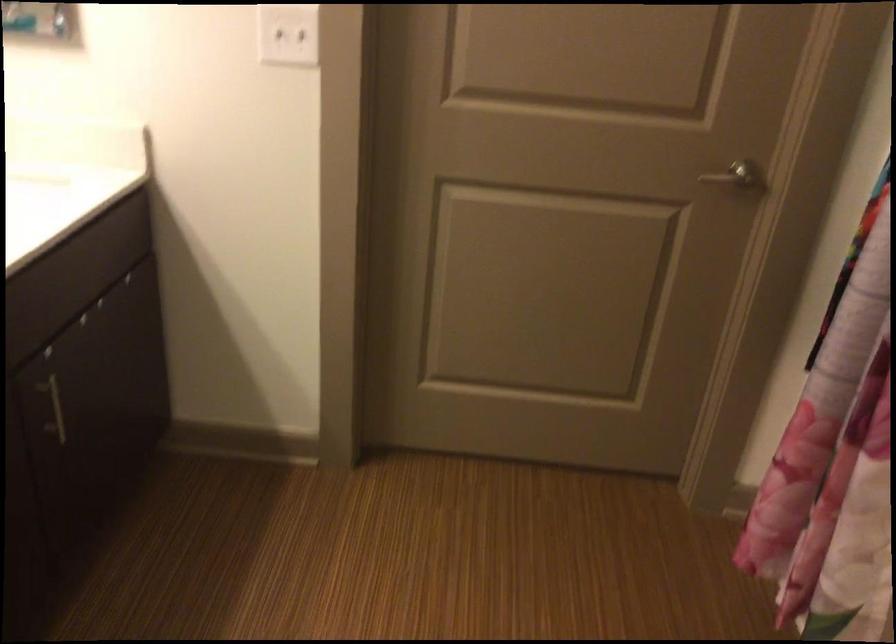
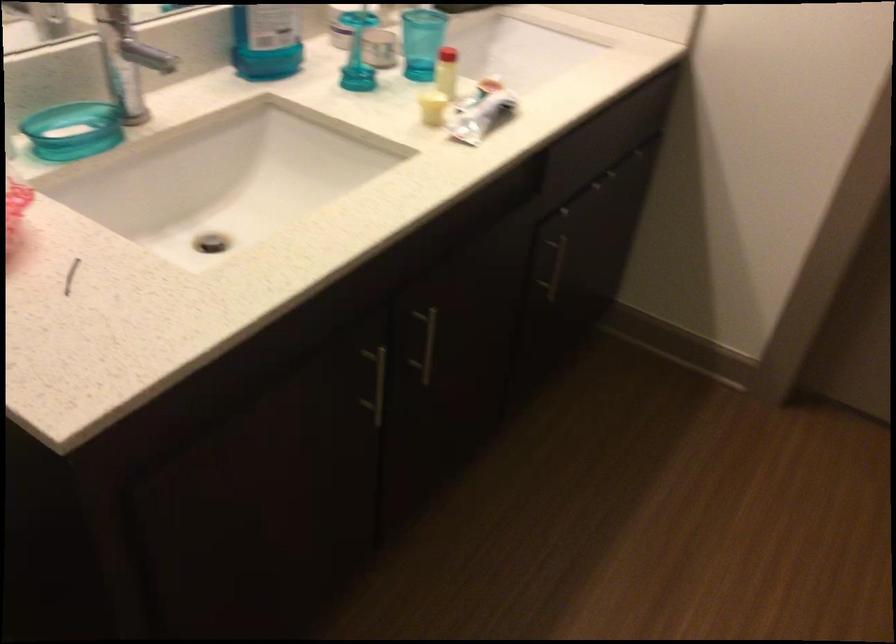
Question: The camera is either moving clockwise (left) or counter-clockwise (right) around the object. The first image is from the beginning of the video and the second image is from the end. Is the camera moving left or right when shooting the video?

Choices:
 (A) Left
 (B) Right

Answer: (B)